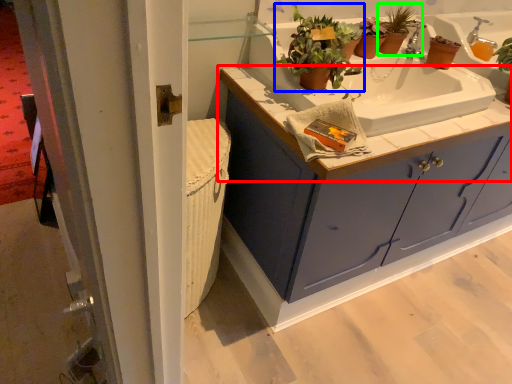
Question: Estimate the real-world distances between objects in this image. Which object is closer to countertop (highlighted by a red box), houseplant (highlighted by a blue box) or houseplant (highlighted by a green box)?

Choices:
 (A) houseplant
 (B) houseplant

Answer: (A)